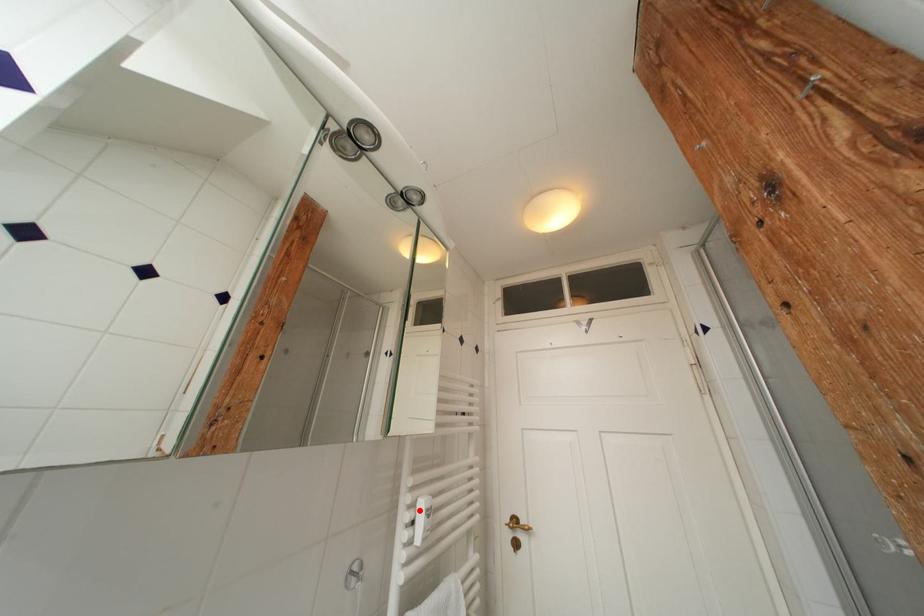
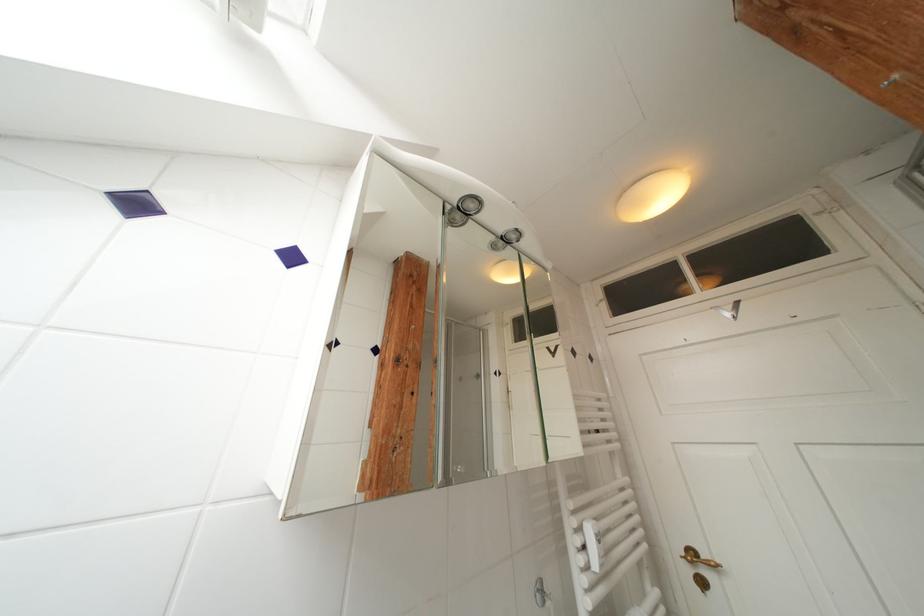
In the second image, find the point that corresponds to the highlighted location in the first image.

(586, 533)